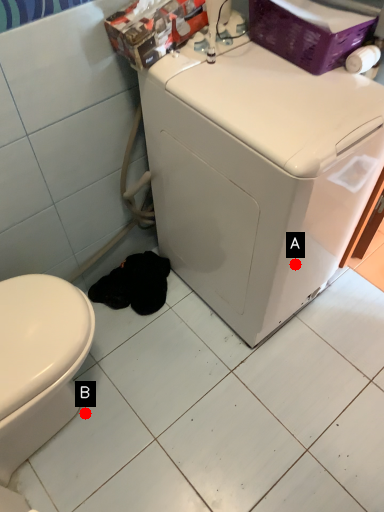
Question: Two points are circled on the image, labeled by A and B beside each circle. Among these points, which one is nearest to the camera?

Choices:
 (A) A is closer
 (B) B is closer

Answer: (A)